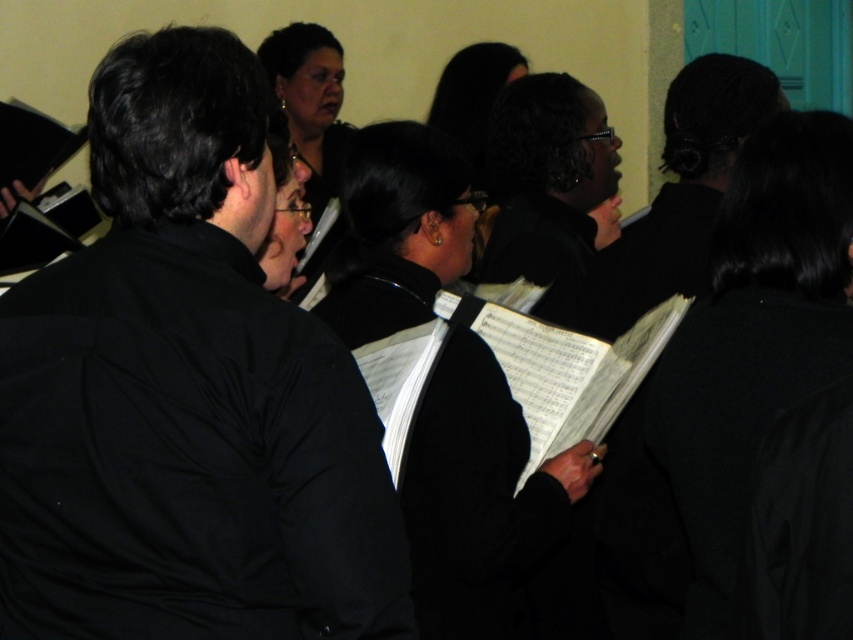
Can you confirm if black matte choir book at center is wider than black glossy hair at upper center?

Correct, the width of black matte choir book at center exceeds that of black glossy hair at upper center.

Measure the distance between black matte choir book at center and black glossy hair at upper center.

black matte choir book at center and black glossy hair at upper center are 2.05 meters apart from each other.

What do you see at coordinates (479, 499) in the screenshot? I see `black matte choir book at center` at bounding box center [479, 499].

Where is `black matte choir book at center`? The height and width of the screenshot is (640, 853). black matte choir book at center is located at coordinates (479, 499).

Which is below, black matte jacket at center or black matte book at center?

black matte book at center is lower down.

Can you confirm if black matte jacket at center is thinner than black matte book at center?

No.

Does point (236, 177) lie in front of point (705, 452)?

Yes, point (236, 177) is closer to viewer.

Identify the location of black matte jacket at center. This screenshot has width=853, height=640. (186, 394).

From the picture: Is black matte book at center above black matte choir book at center?

No, black matte book at center is not above black matte choir book at center.

Who is taller, black matte book at center or black matte choir book at center?

black matte choir book at center is taller.

Between point (700, 508) and point (431, 179), which one is positioned behind?

The point (431, 179) is more distant.

Identify the location of black matte book at center. The height and width of the screenshot is (640, 853). (730, 380).